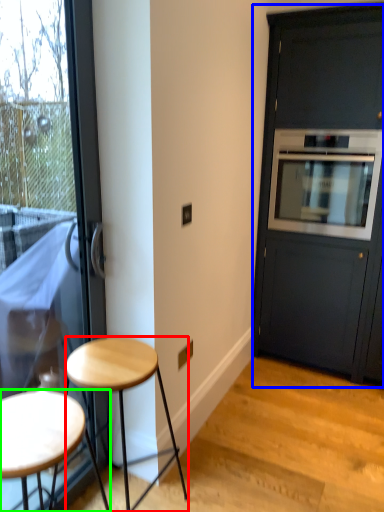
Question: Which is nearer to the stool (highlighted by a red box)? cabinetry (highlighted by a blue box) or stool (highlighted by a green box).

Choices:
 (A) cabinetry
 (B) stool

Answer: (B)